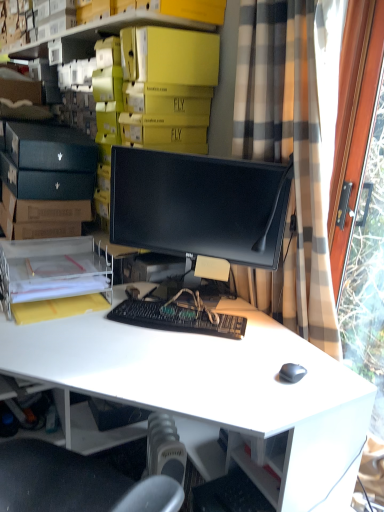
Where is `vacant space situated above white matte desk at center (from a real-world perspective)`? vacant space situated above white matte desk at center (from a real-world perspective) is located at coordinates (160, 348).